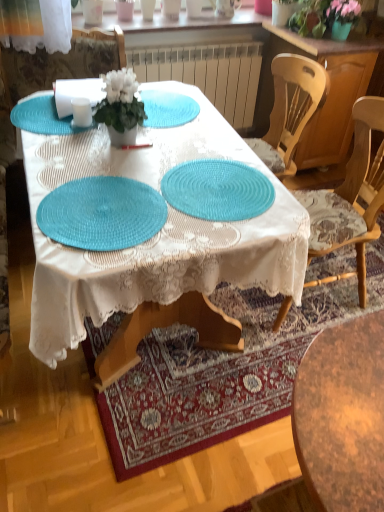
This screenshot has height=512, width=384. What are the coordinates of `free spot below teal woven placemat at center, positioned as the 3th glass plate in top-to-bottom order (from a real-world perspective)` in the screenshot? It's located at (100, 212).